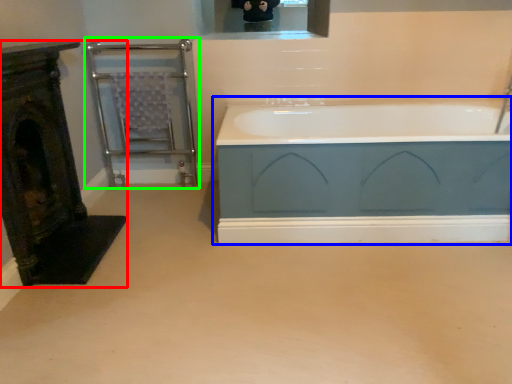
Question: Considering the real-world distances, which object is farthest from fireplace (highlighted by a red box)? bathtub (highlighted by a blue box) or balustrade (highlighted by a green box)?

Choices:
 (A) bathtub
 (B) balustrade

Answer: (A)